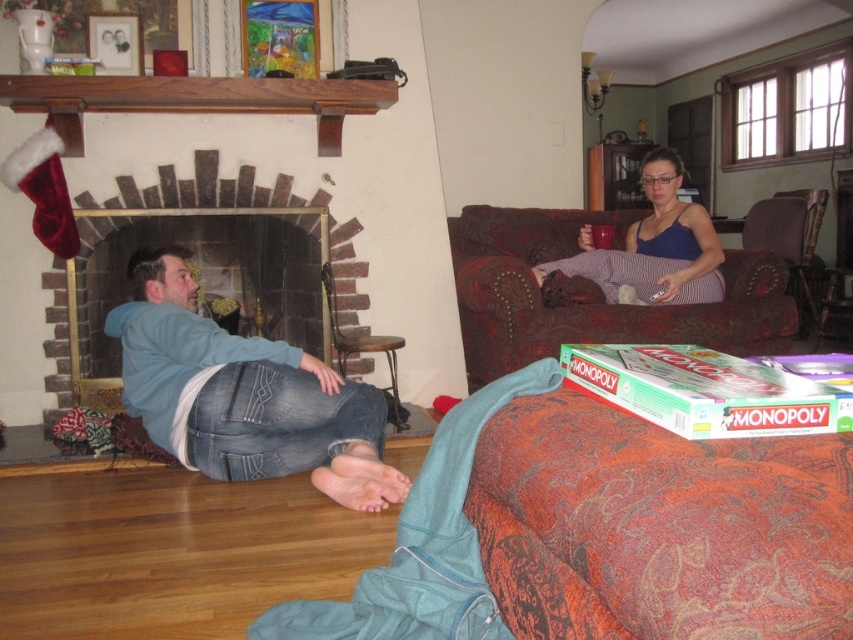
You are a delivery person who needs to place a small package between the blue denim jeans at lower left and the blue fabric dress at center. Can you fit it there?

The blue denim jeans at lower left and blue fabric dress at center are 5.62 feet apart, so yes, the package can be placed between them as there is sufficient space.